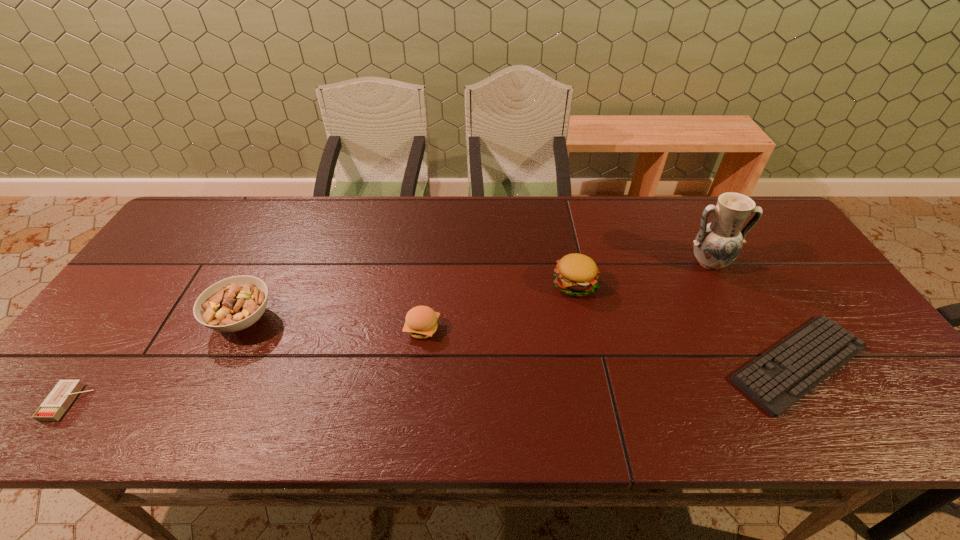
Where is `vacant space that satisfies the following two spatial constraints: 1. on the back side of the shorter hamburger; 2. on the left side of the right hamburger`? The image size is (960, 540). vacant space that satisfies the following two spatial constraints: 1. on the back side of the shorter hamburger; 2. on the left side of the right hamburger is located at coordinates (427, 284).

Image resolution: width=960 pixels, height=540 pixels. Find the location of `free spot that satisfies the following two spatial constraints: 1. on the front side of the right hamburger; 2. on the striking surface of the leftmost object`. free spot that satisfies the following two spatial constraints: 1. on the front side of the right hamburger; 2. on the striking surface of the leftmost object is located at coordinates (599, 402).